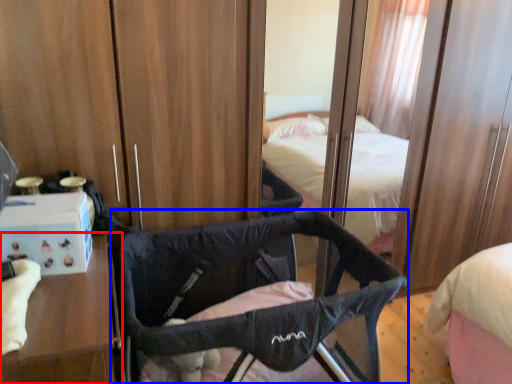
Question: Among these objects, which one is farthest to the camera, furniture (highlighted by a red box) or infant bed (highlighted by a blue box)?

Choices:
 (A) furniture
 (B) infant bed

Answer: (B)